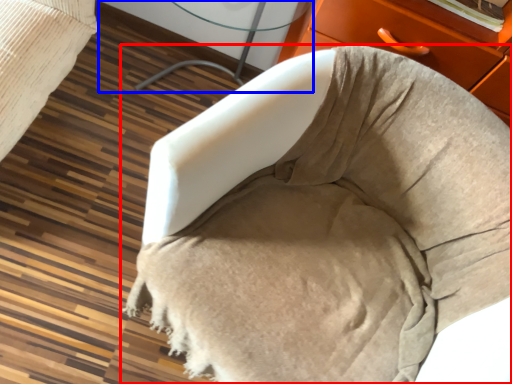
Question: Which object appears closest to the camera in this image, furniture (highlighted by a red box) or table (highlighted by a blue box)?

Choices:
 (A) furniture
 (B) table

Answer: (A)